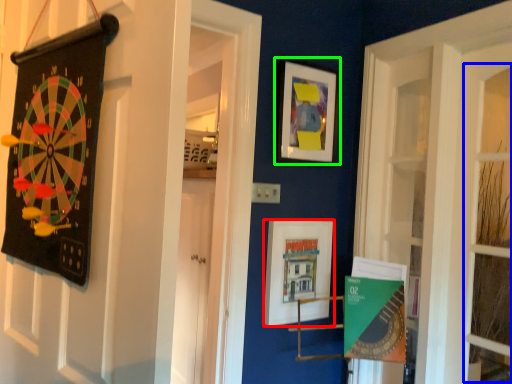
Question: Which object is positioned closest to picture frame (highlighted by a red box)? Select from window (highlighted by a blue box) and picture frame (highlighted by a green box).

Choices:
 (A) window
 (B) picture frame

Answer: (B)